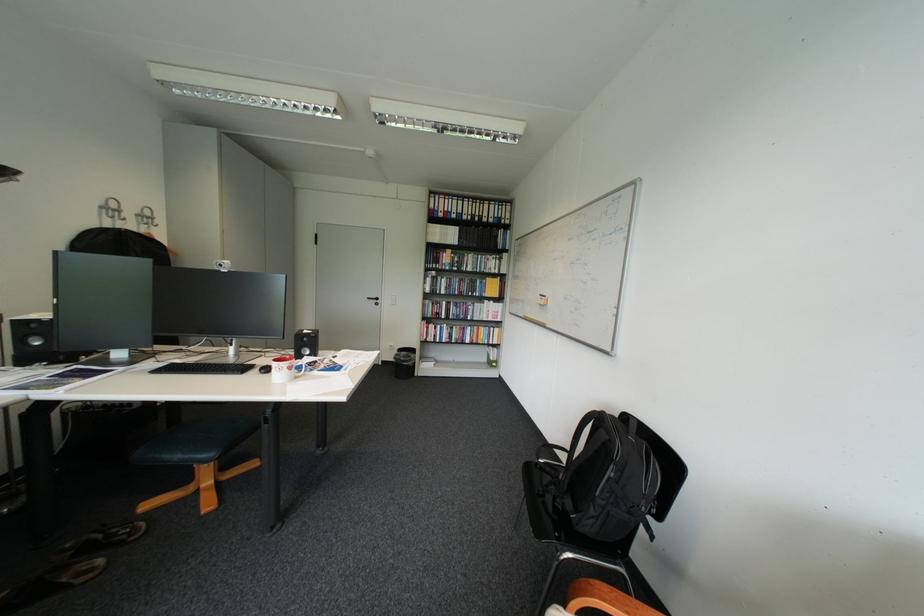
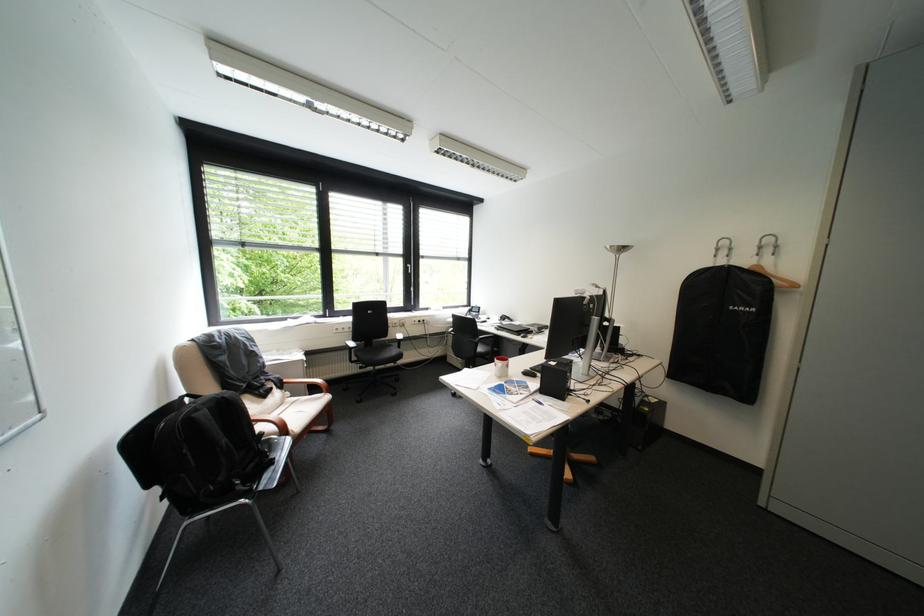
Locate, in the second image, the point that corresponds to [608,496] in the first image.

(254, 427)